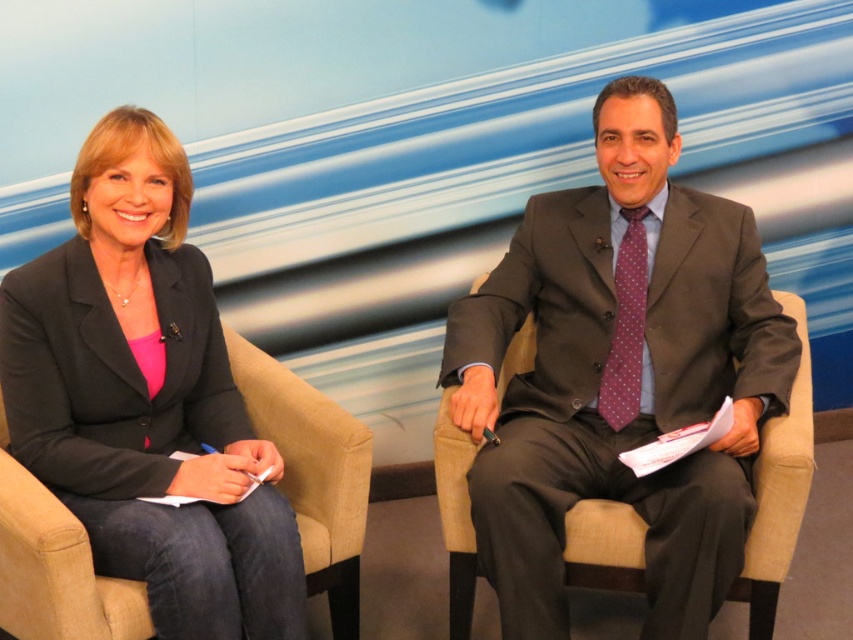
You are a costume designer reviewing the studio setup for a news broadcast. You need to ensure that the matte black blazer at left and the purple dotted fabric tie at right are positioned correctly according to the design plan. Based on the scene description, which object is located to the left of the other?

The matte black blazer at left is to the left of the purple dotted fabric tie at right.

You are a camera operator adjusting the zoom to focus on both the matte gray suit at right and the matte black blazer at left simultaneously. Given that the camera has a maximum zoom range of 25 inches, will you be able to capture both objects in the frame without moving the camera?

The matte gray suit at right and the matte black blazer at left are 27.88 inches apart from each other. Since the camera can only zoom up to 25 inches, it won